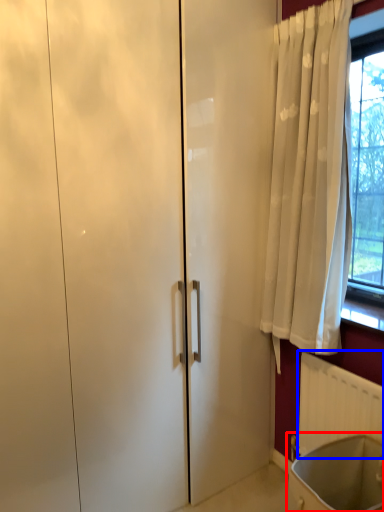
Question: Which object is further to the camera taking this photo, bath (highlighted by a red box) or radiator (highlighted by a blue box)?

Choices:
 (A) bath
 (B) radiator

Answer: (B)